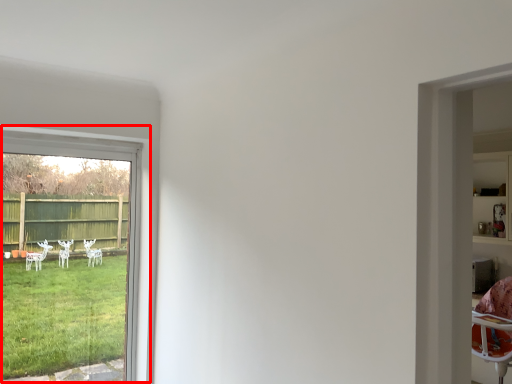
Question: Where is window (annotated by the red box) located in relation to shelf in the image?

Choices:
 (A) left
 (B) right

Answer: (A)